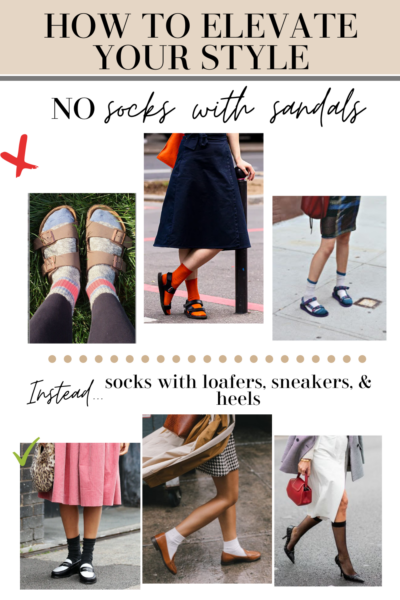
Find the location of a particular element. The image size is (400, 600). total pairs of shoes is located at coordinates (82, 569), (250, 555), (355, 576), (312, 312), (164, 286), (88, 214).